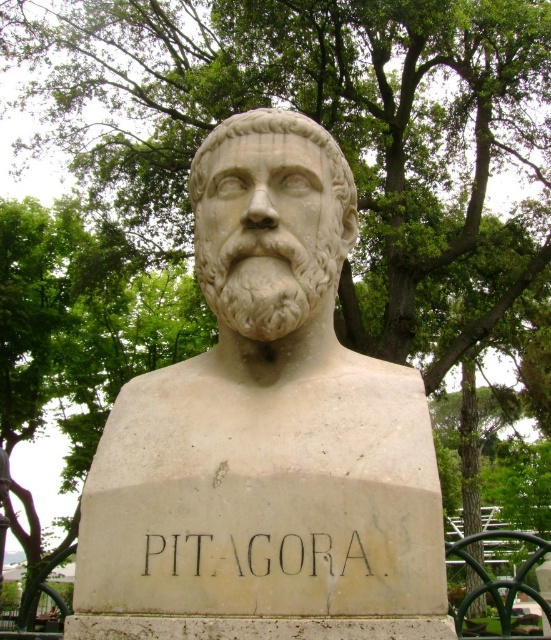
You are standing in a park and see the white stone bust at center. If you walk directly towards the bust, what will be your direction relative to the trees in the background?

The white stone bust at center is located at point (267, 419), so walking directly towards it would mean facing slightly to the right of the trees in the background since the bust is positioned to the right side of the image compared to the centered trees.

You are an art conservator standing 10 feet away from the white stone bust at center and the white marble bust at center. Can you safely walk between them without getting too close? Please explain your reasoning.

The white stone bust at center and the white marble bust at center are 21.92 inches apart. Since 21.92 inches is approximately 1.83 feet, and you are standing 10 feet away from both, there is sufficient space between them for you to walk safely without getting too close.